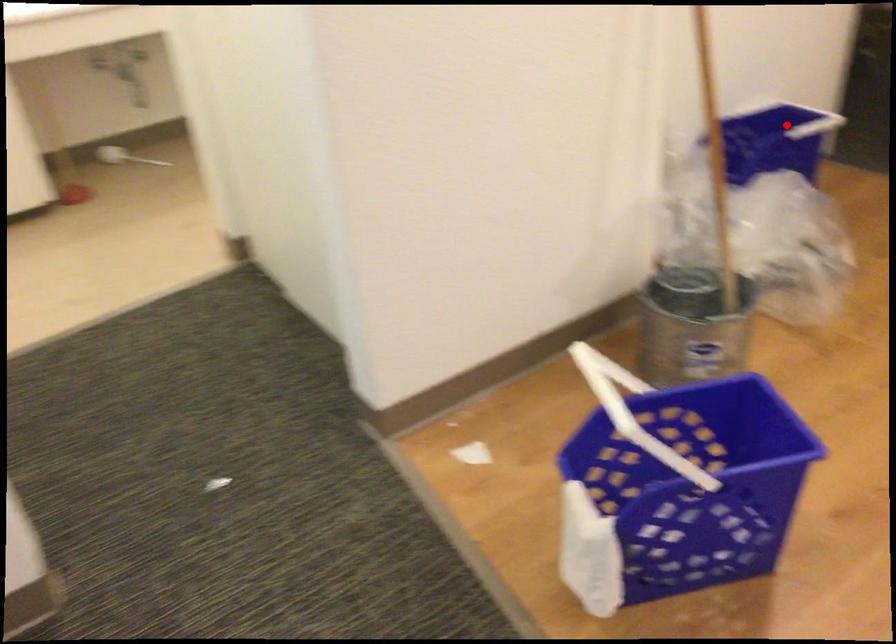
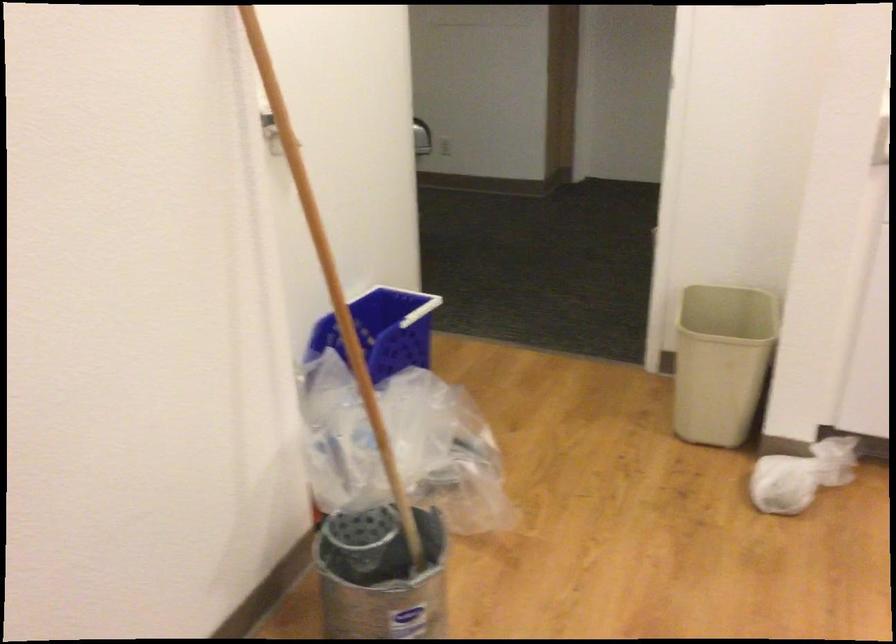
Question: I am providing you with two images of the same scene from different viewpoints. A red point is marked on the first image. At the location where the point appears in image 1, is it still visible in image 2?

Choices:
 (A) Yes
 (B) No

Answer: (A)